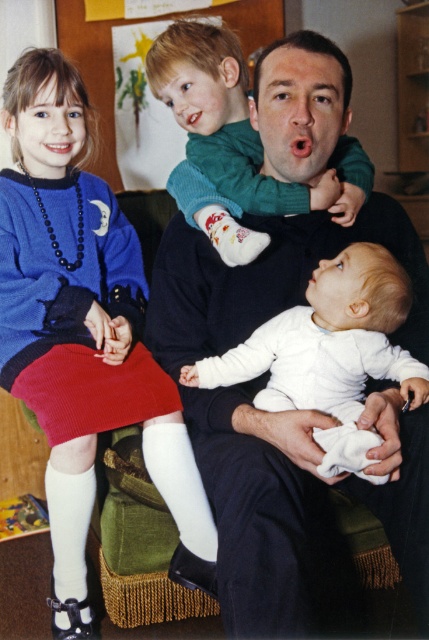
Question: Considering the real-world distances, which object is farthest from the white smooth onesie at lower center?

Choices:
 (A) green sweater at upper center
 (B) knitted blue sweater at upper left

Answer: (B)

Question: Which point is closer to the camera?

Choices:
 (A) green sweater at upper center
 (B) white smooth onesie at lower center

Answer: (B)

Question: Is dark blue sweater at upper center above white smooth onesie at lower center?

Choices:
 (A) no
 (B) yes

Answer: (A)

Question: Does dark blue sweater at upper center appear on the left side of white smooth onesie at lower center?

Choices:
 (A) no
 (B) yes

Answer: (B)

Question: Which object is the closest to the white smooth onesie at lower center?

Choices:
 (A) knitted blue sweater at upper left
 (B) dark blue sweater at upper center
 (C) green sweater at upper center

Answer: (B)

Question: Does white smooth onesie at lower center lie in front of green sweater at upper center?

Choices:
 (A) no
 (B) yes

Answer: (B)